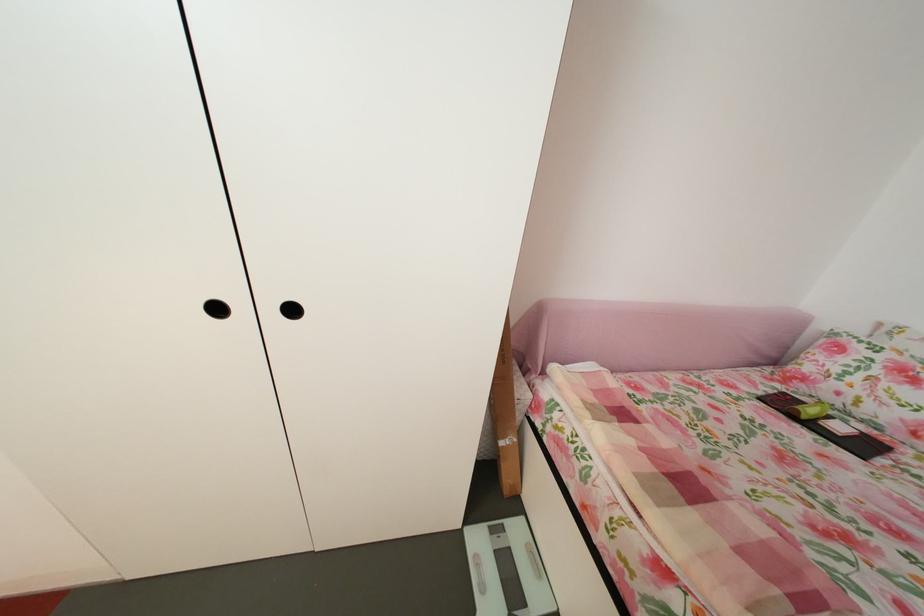
The height and width of the screenshot is (616, 924). I want to click on floral pattern pillow, so click(858, 375).